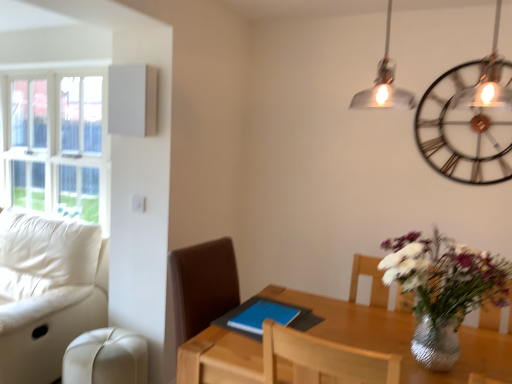
Question: From a real-world perspective, is metallic/textured wall clock at upper right positioned over beige leather swivel chair at lower left based on gravity?

Choices:
 (A) yes
 (B) no

Answer: (A)

Question: Is metallic/textured wall clock at upper right positioned in front of beige leather swivel chair at lower left?

Choices:
 (A) yes
 (B) no

Answer: (B)

Question: Could you tell me if metallic/textured wall clock at upper right is turned towards beige leather swivel chair at lower left?

Choices:
 (A) yes
 (B) no

Answer: (B)

Question: Does metallic/textured wall clock at upper right touch beige leather swivel chair at lower left?

Choices:
 (A) no
 (B) yes

Answer: (A)

Question: Is metallic/textured wall clock at upper right facing away from beige leather swivel chair at lower left?

Choices:
 (A) yes
 (B) no

Answer: (B)

Question: Is metallic/textured wall clock at upper right positioned beyond the bounds of beige leather swivel chair at lower left?

Choices:
 (A) yes
 (B) no

Answer: (A)

Question: From the image's perspective, is metallic/textured wall clock at upper right above white leather couch at left?

Choices:
 (A) no
 (B) yes

Answer: (B)

Question: Is there a large distance between metallic/textured wall clock at upper right and white leather couch at left?

Choices:
 (A) no
 (B) yes

Answer: (B)

Question: Considering the relative sizes of metallic/textured wall clock at upper right and white leather couch at left in the image provided, is metallic/textured wall clock at upper right smaller than white leather couch at left?

Choices:
 (A) yes
 (B) no

Answer: (A)

Question: Is metallic/textured wall clock at upper right not inside white leather couch at left?

Choices:
 (A) no
 (B) yes

Answer: (B)

Question: Is metallic/textured wall clock at upper right to the left of white leather couch at left from the viewer's perspective?

Choices:
 (A) no
 (B) yes

Answer: (A)

Question: Considering the relative sizes of metallic/textured wall clock at upper right and white leather couch at left in the image provided, is metallic/textured wall clock at upper right bigger than white leather couch at left?

Choices:
 (A) no
 (B) yes

Answer: (A)

Question: Considering the relative sizes of white leather couch at left and wooden table at center in the image provided, is white leather couch at left bigger than wooden table at center?

Choices:
 (A) yes
 (B) no

Answer: (A)